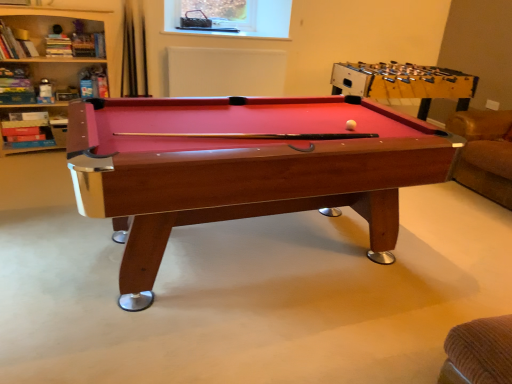
Question: Does wooden billiard table at center lie behind rubberized red pool table at upper right?

Choices:
 (A) yes
 (B) no

Answer: (B)

Question: Does wooden billiard table at center have a greater width compared to rubberized red pool table at upper right?

Choices:
 (A) no
 (B) yes

Answer: (A)

Question: From a real-world perspective, is wooden billiard table at center positioned under rubberized red pool table at upper right based on gravity?

Choices:
 (A) yes
 (B) no

Answer: (A)

Question: Is wooden billiard table at center facing towards rubberized red pool table at upper right?

Choices:
 (A) yes
 (B) no

Answer: (B)

Question: From a real-world perspective, is wooden billiard table at center positioned over rubberized red pool table at upper right based on gravity?

Choices:
 (A) no
 (B) yes

Answer: (A)

Question: Is wooden billiard table at center not inside rubberized red pool table at upper right?

Choices:
 (A) yes
 (B) no

Answer: (A)

Question: From the image's perspective, is wooden billiard table at center located above wooden bookshelf at upper left?

Choices:
 (A) no
 (B) yes

Answer: (A)

Question: Are wooden billiard table at center and wooden bookshelf at upper left far apart?

Choices:
 (A) no
 (B) yes

Answer: (B)

Question: From a real-world perspective, is wooden billiard table at center physically below wooden bookshelf at upper left?

Choices:
 (A) yes
 (B) no

Answer: (A)

Question: Is the position of wooden billiard table at center less distant than that of wooden bookshelf at upper left?

Choices:
 (A) no
 (B) yes

Answer: (B)

Question: Does wooden billiard table at center have a greater width compared to wooden bookshelf at upper left?

Choices:
 (A) no
 (B) yes

Answer: (B)

Question: Is wooden billiard table at center thinner than wooden bookshelf at upper left?

Choices:
 (A) yes
 (B) no

Answer: (B)

Question: Is rubberized red pool table at upper right oriented towards wooden billiard table at center?

Choices:
 (A) yes
 (B) no

Answer: (B)